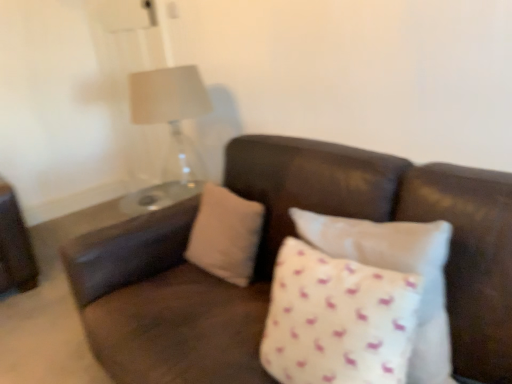
Question: Is white dotted pillow at center, which ranks as the first pillow in front-to-back order, inside or outside of beige fabric pillow at center, which is the first pillow in back-to-front order?

Choices:
 (A) outside
 (B) inside

Answer: (A)

Question: Based on their sizes in the image, would you say white dotted pillow at center, the second pillow from the back, is bigger or smaller than beige fabric pillow at center, which is the first pillow in back-to-front order?

Choices:
 (A) small
 (B) big

Answer: (B)

Question: Considering the positions of point (415, 342) and point (214, 205), is point (415, 342) closer or farther from the camera than point (214, 205)?

Choices:
 (A) closer
 (B) farther

Answer: (A)

Question: Considering the relative positions of beige fabric pillow at center, acting as the 2th pillow starting from the front, and white dotted pillow at center, the second pillow from the back, in the image provided, is beige fabric pillow at center, acting as the 2th pillow starting from the front, to the left or to the right of white dotted pillow at center, the second pillow from the back,?

Choices:
 (A) left
 (B) right

Answer: (A)

Question: From the image's perspective, relative to white dotted pillow at center, which ranks as the first pillow in front-to-back order, is beige fabric pillow at center, acting as the 2th pillow starting from the front, above or below?

Choices:
 (A) above
 (B) below

Answer: (A)

Question: Looking at their shapes, would you say beige fabric pillow at center, which is the first pillow in back-to-front order, is wider or thinner than white dotted pillow at center, which ranks as the first pillow in front-to-back order?

Choices:
 (A) wide
 (B) thin

Answer: (B)

Question: Is beige fabric pillow at center, acting as the 2th pillow starting from the front, spatially inside white dotted pillow at center, the second pillow from the back, or outside of it?

Choices:
 (A) inside
 (B) outside

Answer: (B)